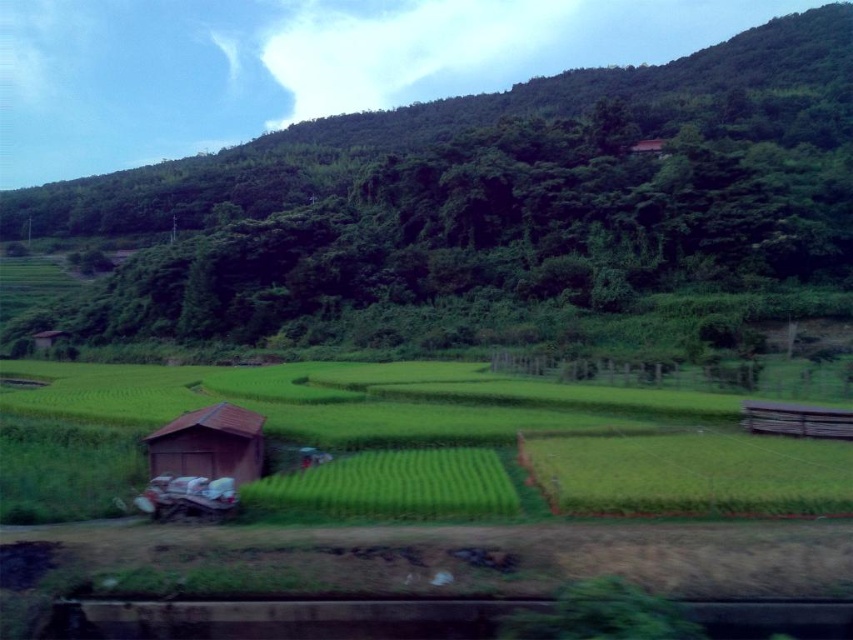
You are standing at the brown wooden hut at lower left and want to reach the green leafy forest at upper center. Which direction should you walk to get there?

To reach the green leafy forest at upper center from the brown wooden hut at lower left, you should walk towards the right direction since the green leafy forest at upper center is located to the right of the brown wooden hut at lower left.

You are a drone operator trying to map the landscape. You need to determine the exact 2D coordinates of the green leafy forest at upper center in the image. What are its coordinates?

The coordinates of the green leafy forest at upper center are at point (x=482, y=193).

You are standing at the brown wooden hut at lower left and want to walk to the green grassy field at center. In which direction should you head?

You should head to the right because the green grassy field at center is to the left of the brown wooden hut at lower left, meaning the field is located in the opposite direction from the hut.